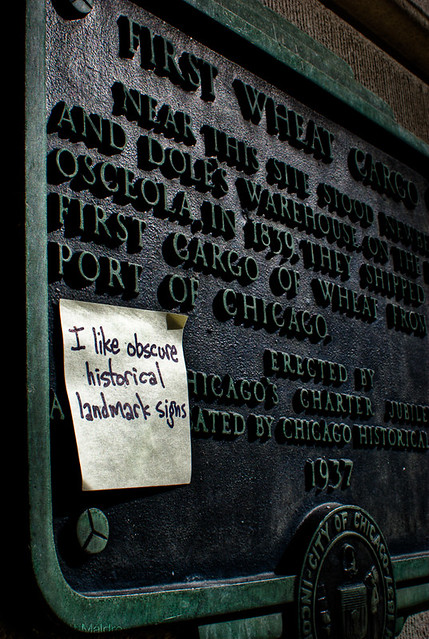
Point out all instances of post it note in the image. Your answer should be formatted as a list of tuples, i.e. [(x1, y1), (x2, y2), ...], where each tuple contains the x and y coordinates of a point satisfying the conditions above.

[(133, 435)]